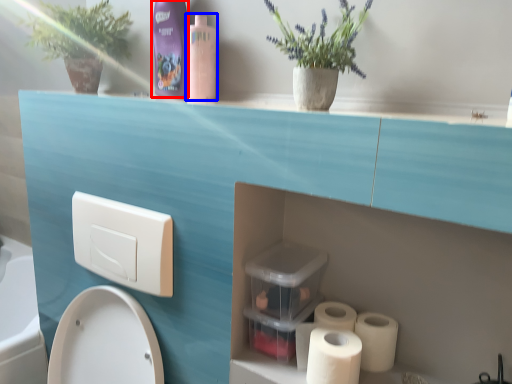
Question: Which of the following is the farthest to the observer, cleaning product (highlighted by a red box) or cleaning product (highlighted by a blue box)?

Choices:
 (A) cleaning product
 (B) cleaning product

Answer: (A)